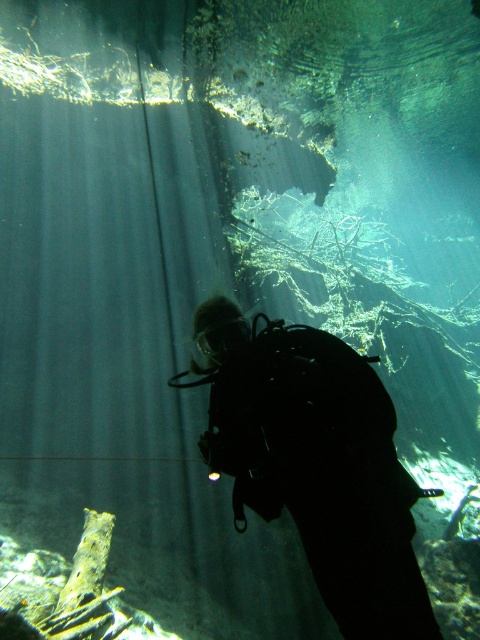
Question: Which point is farther from the camera taking this photo?

Choices:
 (A) (240, 353)
 (B) (453, 518)

Answer: (B)

Question: Is black matte scuba diver at center smaller than shiny silver fish at lower right?

Choices:
 (A) no
 (B) yes

Answer: (A)

Question: Can you confirm if black matte scuba diver at center is bigger than shiny silver fish at lower right?

Choices:
 (A) no
 (B) yes

Answer: (B)

Question: Does black matte scuba diver at center have a lesser width compared to shiny silver fish at lower right?

Choices:
 (A) yes
 (B) no

Answer: (B)